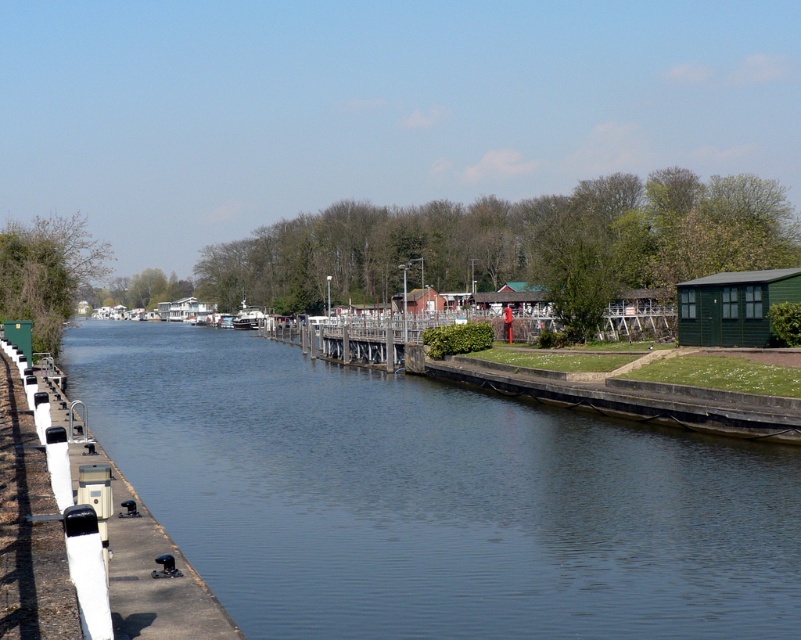
This screenshot has width=801, height=640. Find the location of `white concrete dock at lower left`. white concrete dock at lower left is located at coordinates tap(31, 522).

Is white concrete dock at lower left taller than metallic gray boat at center?

Incorrect, white concrete dock at lower left's height is not larger of metallic gray boat at center's.

This screenshot has height=640, width=801. In order to click on white concrete dock at lower left in this screenshot , I will do `click(31, 522)`.

Which of these two, smooth concrete river at center or white concrete dock at lower left, stands shorter?

white concrete dock at lower left is shorter.

Is smooth concrete river at center shorter than white concrete dock at lower left?

In fact, smooth concrete river at center may be taller than white concrete dock at lower left.

Which is behind, point (598, 550) or point (75, 609)?

Point (598, 550)

The height and width of the screenshot is (640, 801). What are the coordinates of `smooth concrete river at center` in the screenshot? It's located at (433, 499).

From the picture: Measure the distance between smooth concrete river at center and metallic gray boat at center.

smooth concrete river at center is 77.53 meters away from metallic gray boat at center.

Which is more to the left, smooth concrete river at center or metallic gray boat at center?

From the viewer's perspective, metallic gray boat at center appears more on the left side.

Is point (123, 408) positioned in front of point (262, 320)?

Yes, it is.

I want to click on smooth concrete river at center, so click(x=433, y=499).